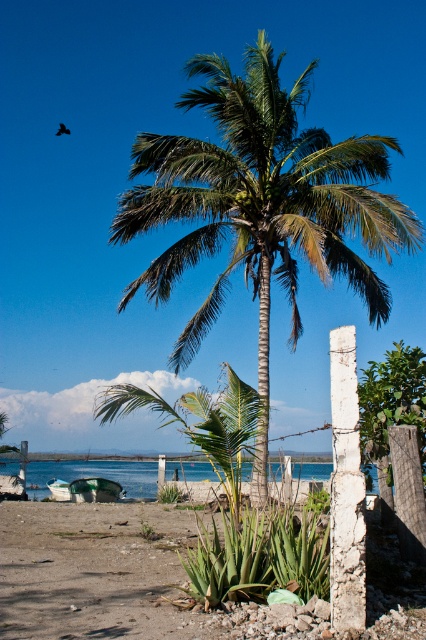
You are a gardener who wants to plant a new flower bed between the green leafy coconut tree at center and the brown sandy soil at lower center. Can you do this?

The green leafy coconut tree at center is located above the brown sandy soil at lower center, so there is no space between them to plant a flower bed.

You are standing at the base of the tall palm tree in the center of the image. Looking down, you notice a specific coordinate point marked on the ground. Which object from the scene is located at the coordinates point (112,577)?

The point (112,577) corresponds to the brown sandy soil at lower center.